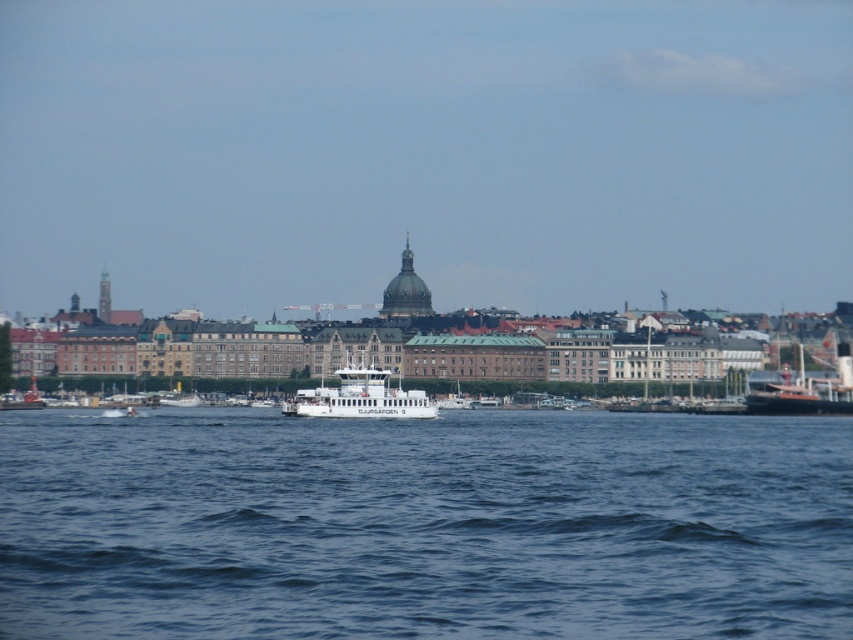
Is blue water at center below white glossy ferry at center?

Correct, blue water at center is located below white glossy ferry at center.

Consider the image. Who is more distant from viewer, [560,584] or [408,397]?

The point [408,397] is more distant.

Which is in front, point (44, 618) or point (372, 392)?

Point (44, 618) is more forward.

The height and width of the screenshot is (640, 853). Identify the location of blue water at center. (422, 525).

Who is higher up, white glossy ferry at center or rustic wooden ship at right?

Positioned higher is rustic wooden ship at right.

Identify the location of white glossy ferry at center. (360, 397).

Locate an element on the screen. The width and height of the screenshot is (853, 640). white glossy ferry at center is located at coordinates [x=360, y=397].

Does blue water at center have a larger size compared to rustic wooden ship at right?

Yes.

From the picture: Which is above, blue water at center or rustic wooden ship at right?

rustic wooden ship at right

I want to click on blue water at center, so click(422, 525).